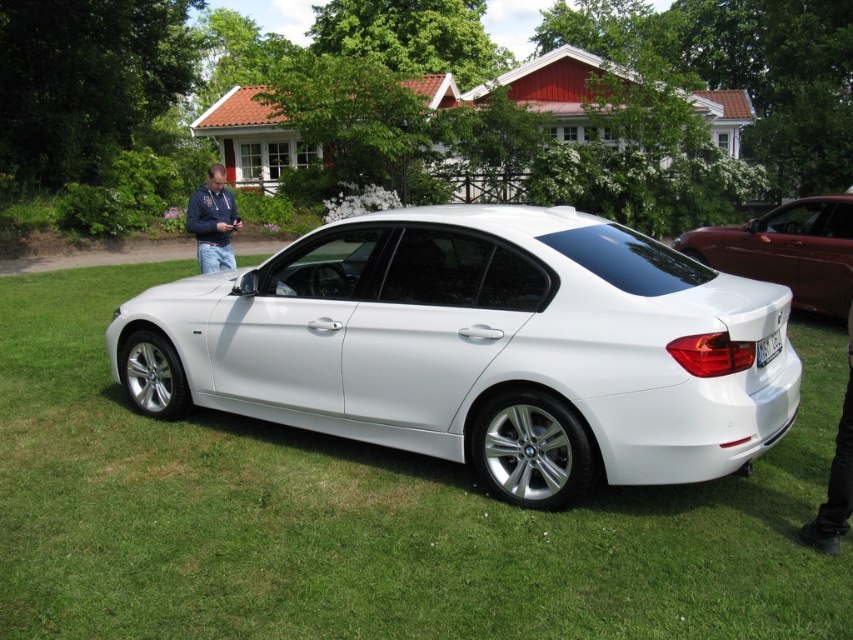
Can you confirm if blue denim jeans at lower left is positioned above white plastic license plate at rear?

Yes, blue denim jeans at lower left is above white plastic license plate at rear.

Find the location of a particular element. This screenshot has width=853, height=640. blue denim jeans at lower left is located at coordinates (213, 221).

Is glossy metallic sedan at right bigger than white plastic license plate at rear?

Correct, glossy metallic sedan at right is larger in size than white plastic license plate at rear.

Between glossy metallic sedan at right and white plastic license plate at rear, which one is positioned higher?

glossy metallic sedan at right

Which is behind, point (732, 236) or point (770, 333)?

Point (732, 236)

Locate an element on the screen. glossy metallic sedan at right is located at coordinates (787, 250).

The width and height of the screenshot is (853, 640). What are the coordinates of `green grass at center` in the screenshot? It's located at (364, 515).

Can you confirm if green grass at center is positioned to the right of white metallic car at center?

Correct, you'll find green grass at center to the right of white metallic car at center.

Who is more forward, (547, 614) or (213, 292)?

Point (547, 614) is in front.

In order to click on green grass at center in this screenshot , I will do `click(364, 515)`.